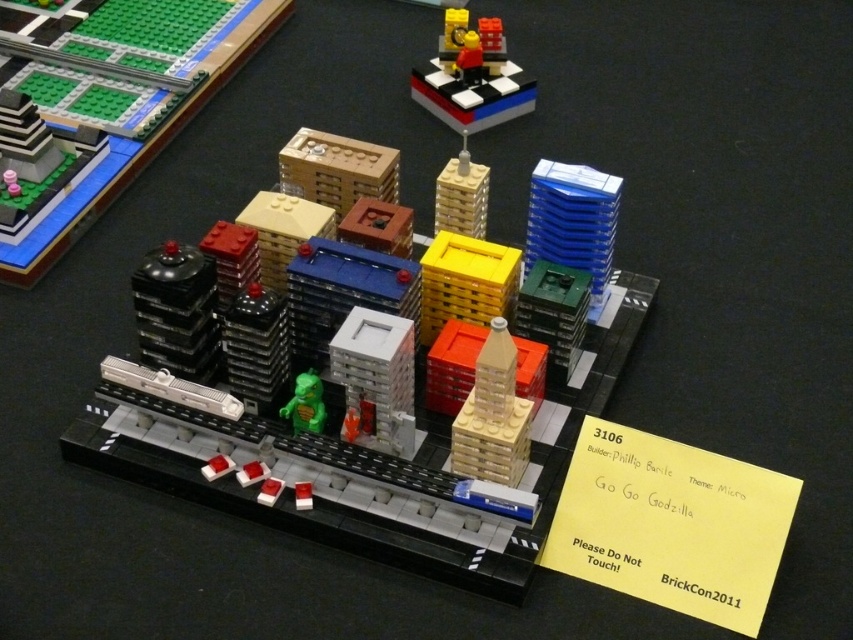
You are a LEGO architect designing a new city layout. You want to place a new building exactly at the coordinates where the shiny black dome at left is located. What are the coordinates where you should place your new building?

The coordinates for the shiny black dome at left are at point (135, 152), so you should place your new building at those coordinates.